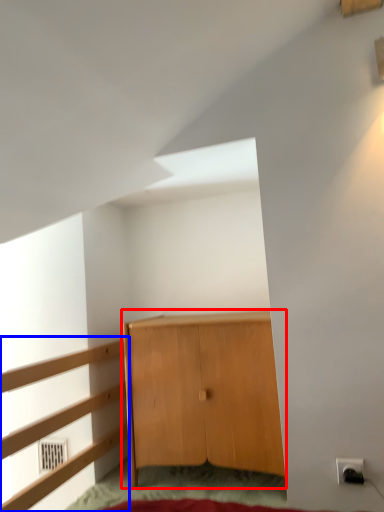
Question: Which object appears closest to the camera in this image, cupboard (highlighted by a red box) or dresser (highlighted by a blue box)?

Choices:
 (A) cupboard
 (B) dresser

Answer: (B)